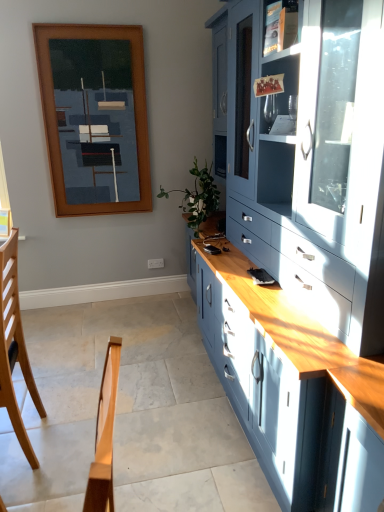
Question: Is matte blue cabinet at right in contact with wooden picture frame at upper left?

Choices:
 (A) yes
 (B) no

Answer: (B)

Question: Does matte blue cabinet at right have a lesser height compared to wooden picture frame at upper left?

Choices:
 (A) no
 (B) yes

Answer: (A)

Question: Could wooden picture frame at upper left be considered to be inside matte blue cabinet at right?

Choices:
 (A) no
 (B) yes

Answer: (A)

Question: Is matte blue cabinet at right smaller than wooden picture frame at upper left?

Choices:
 (A) yes
 (B) no

Answer: (B)

Question: Could you tell me if matte blue cabinet at right is facing wooden picture frame at upper left?

Choices:
 (A) no
 (B) yes

Answer: (B)

Question: Is matte blue cabinet at right not within wooden picture frame at upper left?

Choices:
 (A) no
 (B) yes

Answer: (B)

Question: Is matte glass shelf at upper right not close to green leafy plant at center?

Choices:
 (A) no
 (B) yes

Answer: (B)

Question: Is matte glass shelf at upper right wider than green leafy plant at center?

Choices:
 (A) no
 (B) yes

Answer: (A)

Question: Does matte glass shelf at upper right lie in front of green leafy plant at center?

Choices:
 (A) no
 (B) yes

Answer: (B)

Question: Is matte glass shelf at upper right thinner than green leafy plant at center?

Choices:
 (A) yes
 (B) no

Answer: (A)

Question: From a real-world perspective, is matte glass shelf at upper right under green leafy plant at center?

Choices:
 (A) no
 (B) yes

Answer: (A)

Question: Is matte glass shelf at upper right aimed at green leafy plant at center?

Choices:
 (A) no
 (B) yes

Answer: (A)

Question: From the image's perspective, is matte blue cabinet at right beneath light brown wood chair at lower left?

Choices:
 (A) yes
 (B) no

Answer: (B)